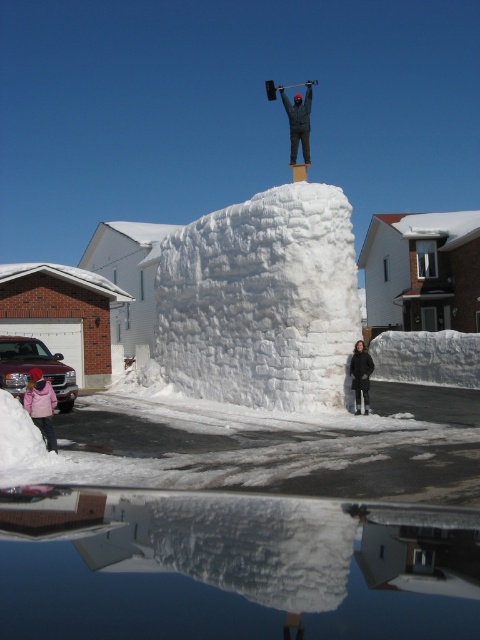
Who is positioned more to the right, matte pink jacket at lower left or black matte jacket at lower center?

black matte jacket at lower center

Is point (48, 442) positioned after point (364, 372)?

No, it is in front of (364, 372).

You are a GUI agent. You are given a task and a screenshot of the screen. Output one action in this format:
    pyautogui.click(x=<x>, y=<y>)
    Task: Click on the matte pink jacket at lower left
    
    Given the screenshot: What is the action you would take?
    click(40, 406)

Does dark gray fabric at upper center appear on the right side of black matte jacket at lower center?

Indeed, dark gray fabric at upper center is positioned on the right side of black matte jacket at lower center.

Who is positioned more to the left, dark gray fabric at upper center or black matte jacket at lower center?

black matte jacket at lower center is more to the left.

Who is more forward, (278, 90) or (357, 365)?

Point (357, 365) is in front.

Find the location of a particular element. This screenshot has width=480, height=640. dark gray fabric at upper center is located at coordinates (299, 122).

Does matte pink jacket at lower left lie in front of dark gray fabric at upper center?

Yes, matte pink jacket at lower left is closer to the viewer.

What do you see at coordinates (40, 406) in the screenshot? This screenshot has height=640, width=480. I see `matte pink jacket at lower left` at bounding box center [40, 406].

This screenshot has width=480, height=640. In order to click on matte pink jacket at lower left in this screenshot , I will do `click(40, 406)`.